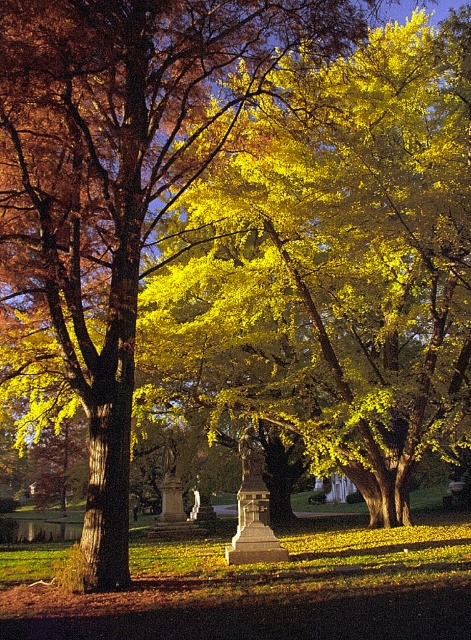
Between yellow/golden leaves at center and golden yellow leaves at center, which one is positioned higher?

yellow/golden leaves at center is higher up.

Which is in front, point (455, 410) or point (37, 74)?

Point (37, 74)

Identify the location of yellow/golden leaves at center. This screenshot has width=471, height=640. (334, 266).